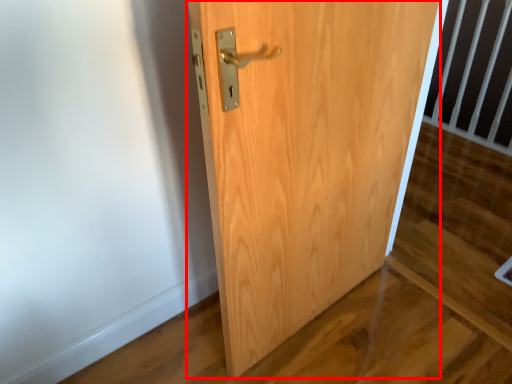
Question: Observing the image, what is the correct spatial positioning of door (annotated by the red box) in reference to balustrade?

Choices:
 (A) right
 (B) left

Answer: (B)